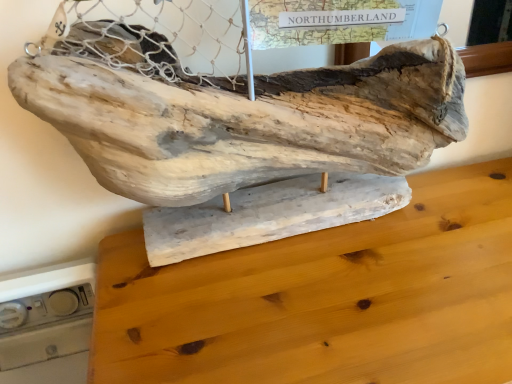
Question: Is natural wood sculpture at center taller or shorter than natural wood table at center?

Choices:
 (A) short
 (B) tall

Answer: (A)

Question: From a real-world perspective, is natural wood sculpture at center above or below natural wood table at center?

Choices:
 (A) below
 (B) above

Answer: (B)

Question: In terms of width, does natural wood sculpture at center look wider or thinner when compared to natural wood table at center?

Choices:
 (A) thin
 (B) wide

Answer: (A)

Question: Looking at their shapes, would you say natural wood table at center is wider or thinner than natural wood sculpture at center?

Choices:
 (A) wide
 (B) thin

Answer: (A)

Question: Would you say natural wood table at center is inside or outside natural wood sculpture at center?

Choices:
 (A) outside
 (B) inside

Answer: (A)

Question: Considering their positions, is natural wood table at center located in front of or behind natural wood sculpture at center?

Choices:
 (A) behind
 (B) front

Answer: (B)

Question: Considering the positions of point (182, 274) and point (218, 137), is point (182, 274) closer or farther from the camera than point (218, 137)?

Choices:
 (A) farther
 (B) closer

Answer: (A)